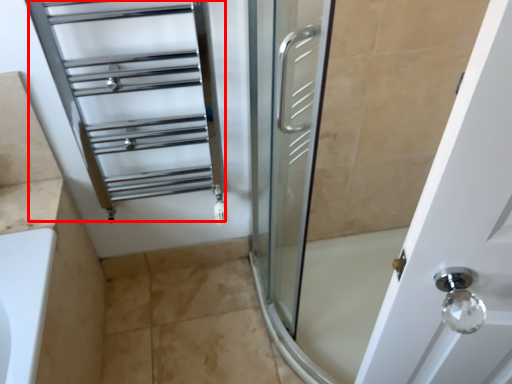
Question: Considering the relative positions of cage (annotated by the red box) and tile in the image provided, where is cage (annotated by the red box) located with respect to the staircase?

Choices:
 (A) left
 (B) right

Answer: (A)